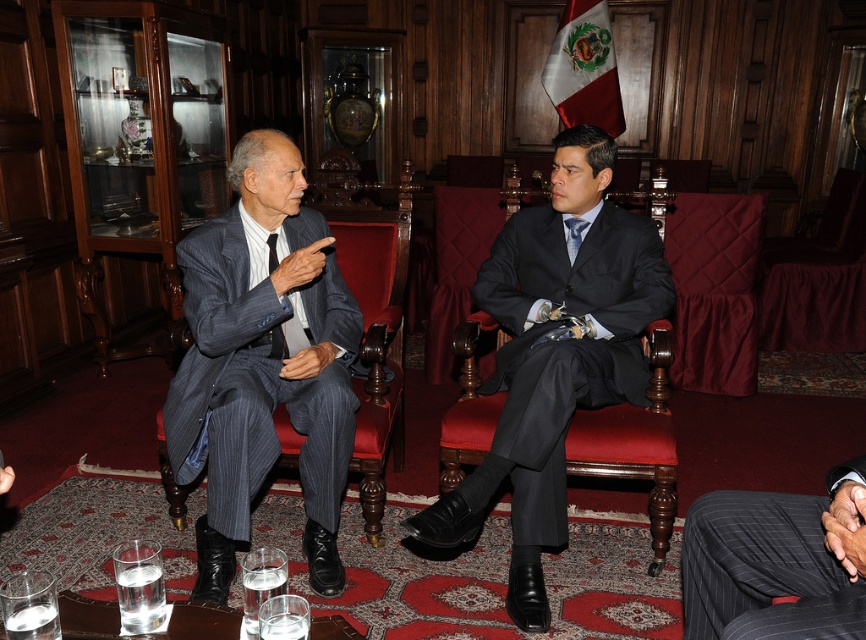
Which is in front, point (516, 564) or point (565, 220)?

Point (516, 564) is more forward.

Who is higher up, matte black suit at center or blue silk tie at center?

blue silk tie at center is above.

Is point (598, 182) farther from viewer compared to point (574, 253)?

That is False.

Locate an element on the screen. The image size is (866, 640). matte black suit at center is located at coordinates (554, 355).

Is the position of dark gray pinstripe suit at left less distant than that of matte black tie at upper left?

Yes, dark gray pinstripe suit at left is in front of matte black tie at upper left.

Does dark gray pinstripe suit at left lie behind matte black tie at upper left?

No, dark gray pinstripe suit at left is in front of matte black tie at upper left.

What do you see at coordinates (263, 362) in the screenshot? This screenshot has height=640, width=866. I see `dark gray pinstripe suit at left` at bounding box center [263, 362].

Where is `dark gray pinstripe suit at left`? This screenshot has height=640, width=866. dark gray pinstripe suit at left is located at coordinates (263, 362).

Is dark gray pinstripe suit at left thinner than pinstriped fabric suit at center?

No.

Can you confirm if dark gray pinstripe suit at left is positioned to the left of pinstriped fabric suit at center?

Yes, dark gray pinstripe suit at left is to the left of pinstriped fabric suit at center.

Where is `dark gray pinstripe suit at left`? dark gray pinstripe suit at left is located at coordinates (263, 362).